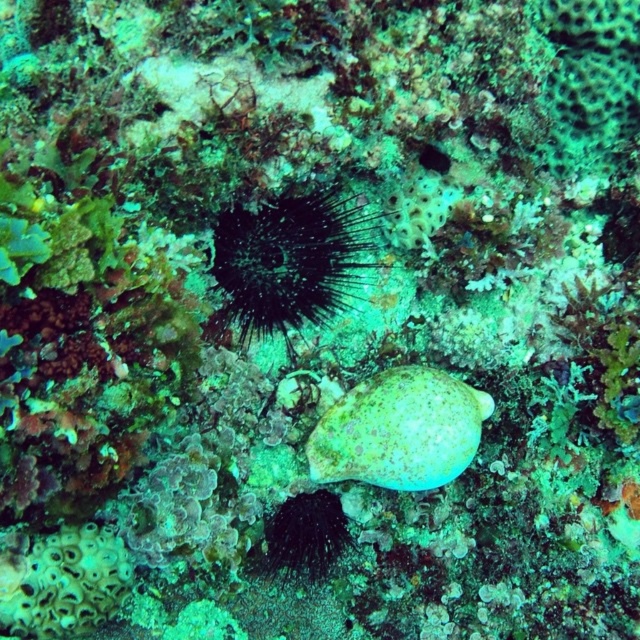
You are a marine biologist examining the underwater scene. You need to collect samples starting from the closest object to the farthest. Which object should you collect first, the dark spiny sea urchin at center or the speckled green shell at center?

The dark spiny sea urchin at center is closer to you than the speckled green shell at center, so you should collect the dark spiny sea urchin at center first.

Looking at this image, you are a marine biologist examining an underwater image. You notice two points of interest labeled as point [307,196] and point [332,412]. Based on the image, which point is nearer to the camera?

Point [307,196] is closer to the camera than point [332,412].